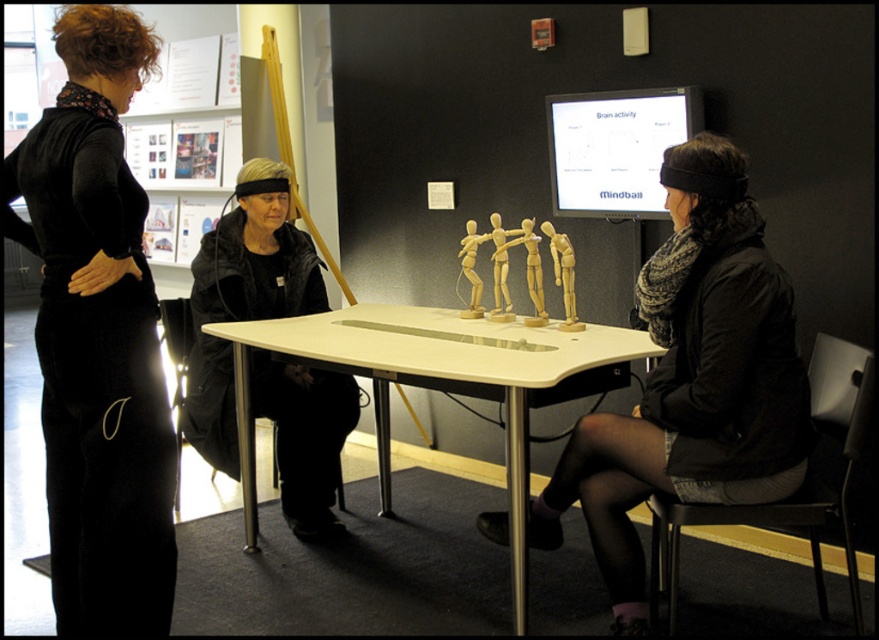
Does black fabric dress at left have a larger size compared to wooden mannequin at center?

No.

Between black fabric dress at left and wooden mannequin at center, which one has less height?

wooden mannequin at center is shorter.

You are a GUI agent. You are given a task and a screenshot of the screen. Output one action in this format:
    pyautogui.click(x=<x>, y=<y>)
    Task: Click on the black fabric dress at left
    
    Given the screenshot: What is the action you would take?
    pyautogui.click(x=97, y=337)

Who is more forward, (258, 216) or (519, 592)?

Point (519, 592) is more forward.

From the picture: Is black matte jacket at center taller than white glossy table at center?

Indeed, black matte jacket at center has a greater height compared to white glossy table at center.

Find the location of `black matte jacket at center`. black matte jacket at center is located at coordinates (243, 298).

How much distance is there between wooden mannequin at center and white glossy table at center?

21.57 inches

Is point (663, 282) farther from viewer compared to point (375, 355)?

No.

Measure the distance between wooden mannequin at center and camera.

wooden mannequin at center is 6.71 feet away from camera.

The image size is (879, 640). Find the location of `wooden mannequin at center`. wooden mannequin at center is located at coordinates coord(691,380).